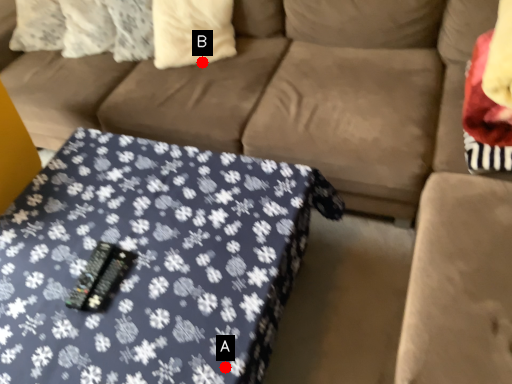
Question: Two points are circled on the image, labeled by A and B beside each circle. Which point is closer to the camera?

Choices:
 (A) A is closer
 (B) B is closer

Answer: (A)